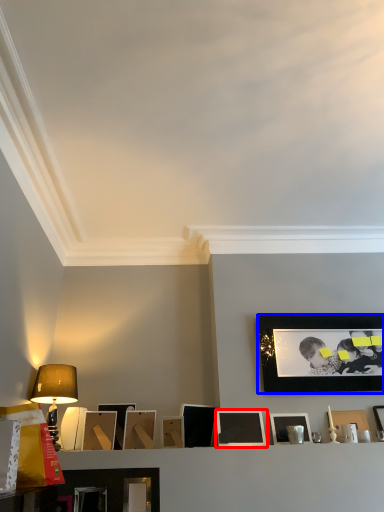
Question: Which object is closer to the camera taking this photo, picture frame (highlighted by a red box) or picture frame (highlighted by a blue box)?

Choices:
 (A) picture frame
 (B) picture frame

Answer: (A)